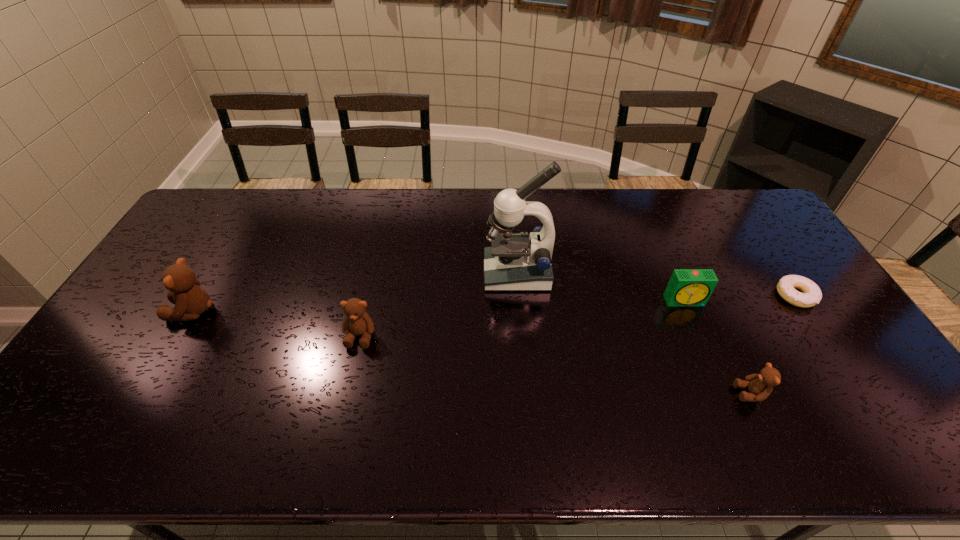
I want to click on the fourth object from right to left, so click(x=514, y=262).

The image size is (960, 540). I want to click on vacant space located on the face of the second teddy bear from left to right, so click(349, 382).

I want to click on vacant region located 0.200m on the face of the rightmost teddy bear, so click(x=656, y=393).

Where is `vacant space located on the face of the rightmost teddy bear`? vacant space located on the face of the rightmost teddy bear is located at coordinates (700, 393).

The height and width of the screenshot is (540, 960). Identify the location of vacant area situated 0.130m on the face of the rightmost teddy bear. tap(684, 393).

You are a GUI agent. You are given a task and a screenshot of the screen. Output one action in this format:
    pyautogui.click(x=<x>, y=<y>)
    Task: Click on the vacant region located 0.350m on the back of the doughnut
    The image size is (960, 540).
    Given the screenshot: What is the action you would take?
    pyautogui.click(x=740, y=212)

At what (x,y) coordinates should I click in order to perform the action: click on free spot located 0.100m on the front-facing side of the alarm clock. Please return your answer as a coordinate pair (x, y). Looking at the image, I should click on (699, 335).

Identify the location of vacant space located on the left of the tallest object. The image size is (960, 540). (411, 273).

The height and width of the screenshot is (540, 960). I want to click on object that is at the near edge, so click(x=760, y=386).

What are the coordinates of `object that is at the left edge` in the screenshot? It's located at (191, 300).